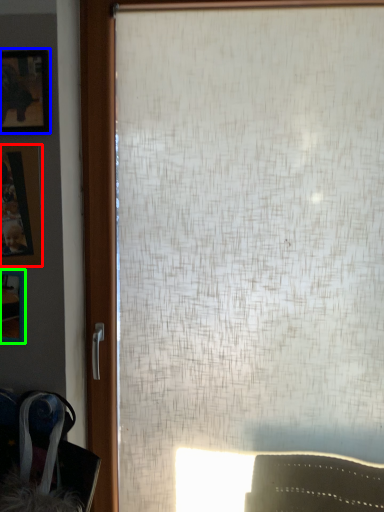
Question: Estimate the real-world distances between objects in this image. Which object is farther from picture frame (highlighted by a red box), picture frame (highlighted by a blue box) or picture frame (highlighted by a green box)?

Choices:
 (A) picture frame
 (B) picture frame

Answer: (A)